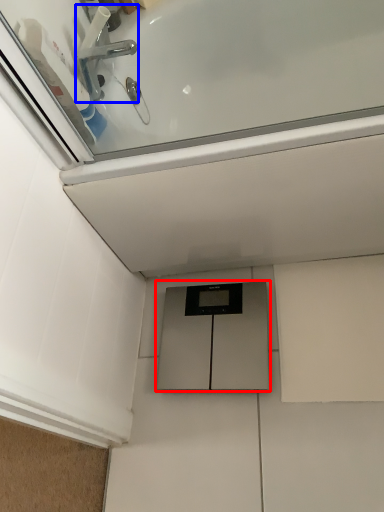
Question: Which object appears farthest to the camera in this image, cabinetry (highlighted by a red box) or tap (highlighted by a blue box)?

Choices:
 (A) cabinetry
 (B) tap

Answer: (A)